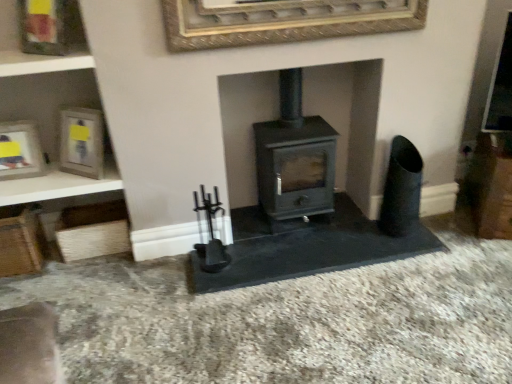
Locate an element on the screen. Image resolution: width=512 pixels, height=384 pixels. vacant region to the left of matte gray wood burning stove at center is located at coordinates (246, 233).